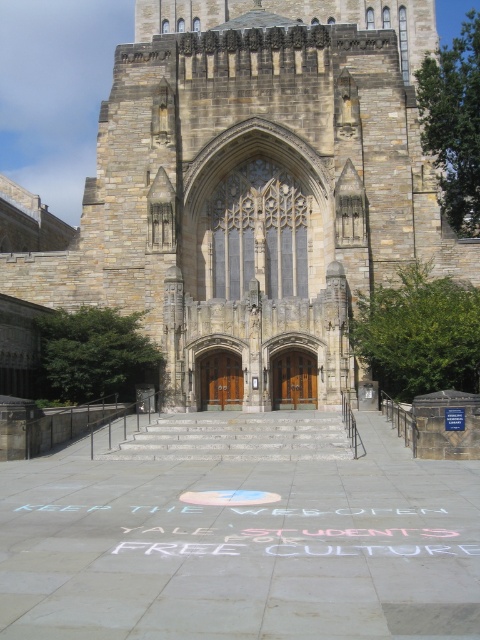
From the picture: Who is more distant from viewer, (156, 291) or (124, 532)?

The point (156, 291) is more distant.

Which is in front, point (405, 28) or point (166, 515)?

Positioned in front is point (166, 515).

The height and width of the screenshot is (640, 480). I want to click on stone church at center, so click(x=254, y=186).

Does stone church at center appear under brown wooden doors at center?

Actually, stone church at center is above brown wooden doors at center.

Does stone church at center have a greater height compared to brown wooden doors at center?

Indeed, stone church at center has a greater height compared to brown wooden doors at center.

This screenshot has height=640, width=480. In order to click on stone church at center in this screenshot , I will do `click(254, 186)`.

Where is `stone church at center`? stone church at center is located at coordinates (254, 186).

Locate an element on the screen. This screenshot has height=640, width=480. white chalk writing at center is located at coordinates (290, 532).

Is white chalk writing at center above brown wooden door at center?

Incorrect, white chalk writing at center is not positioned above brown wooden door at center.

Who is more forward, (265, 548) or (294, 387)?

Positioned in front is point (265, 548).

Where is `white chalk writing at center`? The width and height of the screenshot is (480, 640). white chalk writing at center is located at coordinates (290, 532).